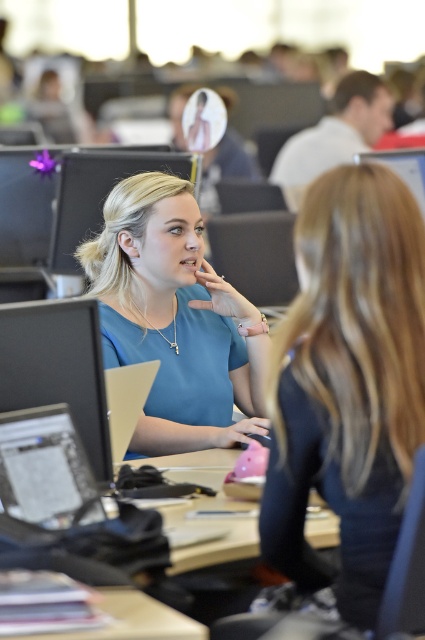
Who is lower down, black matte shirt at center or blue fabric shirt at center?

Positioned lower is black matte shirt at center.

Is point (322, 577) farther from viewer compared to point (214, 323)?

That is False.

Where is `black matte shirt at center`? This screenshot has height=640, width=425. black matte shirt at center is located at coordinates (346, 388).

Find the location of `black matte shirt at center`. black matte shirt at center is located at coordinates (346, 388).

Consider the image. Between blue fabric shirt at center and matte black monitor at center, which one has less height?

matte black monitor at center

Does blue fabric shirt at center appear under matte black monitor at center?

Indeed, blue fabric shirt at center is positioned under matte black monitor at center.

Identify the location of blue fabric shirt at center. Image resolution: width=425 pixels, height=640 pixels. (175, 317).

Is matte black monitor at left thinner than matte black monitor at center?

Correct, matte black monitor at left's width is less than matte black monitor at center's.

Does matte black monitor at left have a lesser height compared to matte black monitor at center?

Correct, matte black monitor at left is not as tall as matte black monitor at center.

Between point (68, 394) and point (76, 237), which one is positioned behind?

Point (76, 237)

In order to click on matte black monitor at left in this screenshot , I will do [x=57, y=369].